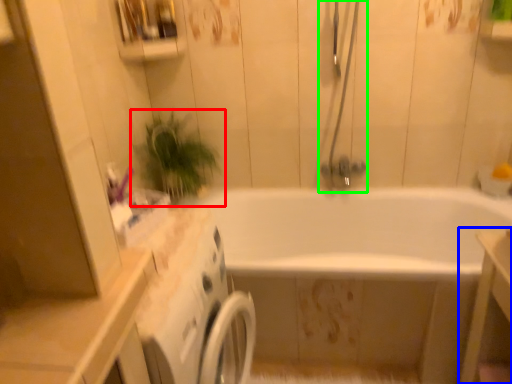
Question: Based on their relative distances, which object is farther from houseplant (highlighted by a red box)? Choose from vanity (highlighted by a blue box) and shower door (highlighted by a green box).

Choices:
 (A) vanity
 (B) shower door

Answer: (A)